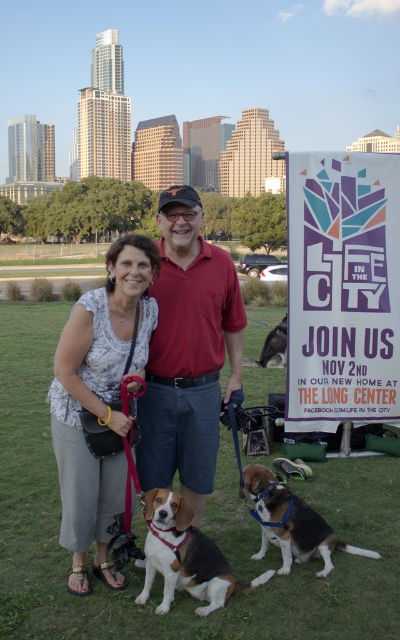
You are a photographer trying to capture a clear shot of both the white printed blouse at center and the brown and white fur dog at lower center. Which one of these two subjects will appear larger in the photo?

The white printed blouse at center will appear larger in the photo because it is taller than the brown and white fur dog at lower center.